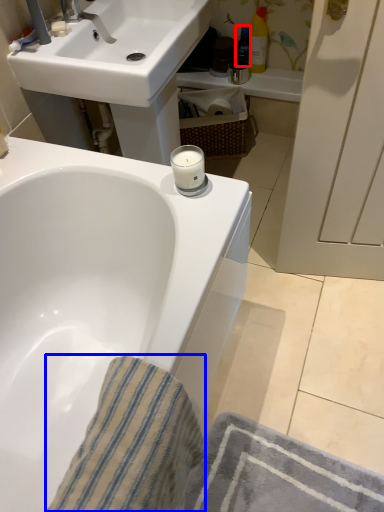
Question: Which object is closer to the camera taking this photo, toiletry (highlighted by a red box) or bath towel (highlighted by a blue box)?

Choices:
 (A) toiletry
 (B) bath towel

Answer: (B)